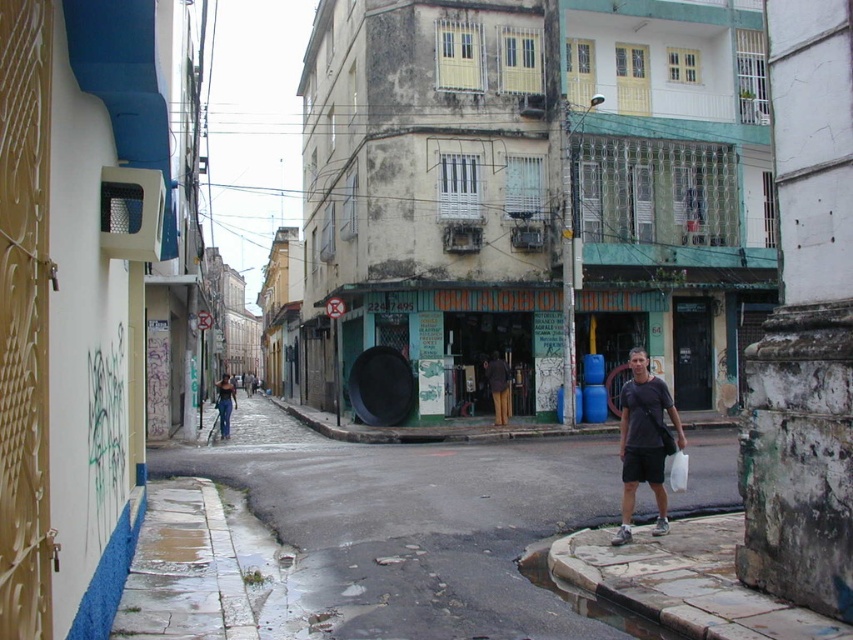
Question: Which point is farther to the camera?

Choices:
 (A) matte black jacket at center
 (B) dark gray t-shirt at center

Answer: (A)

Question: Which point is closer to the camera?

Choices:
 (A) (231, 381)
 (B) (677, 429)

Answer: (B)

Question: Can you confirm if dark gray t-shirt at center is positioned to the right of matte black jacket at center?

Choices:
 (A) yes
 (B) no

Answer: (A)

Question: Which of the following is the closest to the observer?

Choices:
 (A) dark gray t-shirt at center
 (B) matte black jacket at center

Answer: (A)

Question: Does dark gray t-shirt at center come in front of matte black jacket at center?

Choices:
 (A) yes
 (B) no

Answer: (A)

Question: Can you confirm if dark gray t-shirt at center is thinner than matte black jacket at center?

Choices:
 (A) yes
 (B) no

Answer: (A)